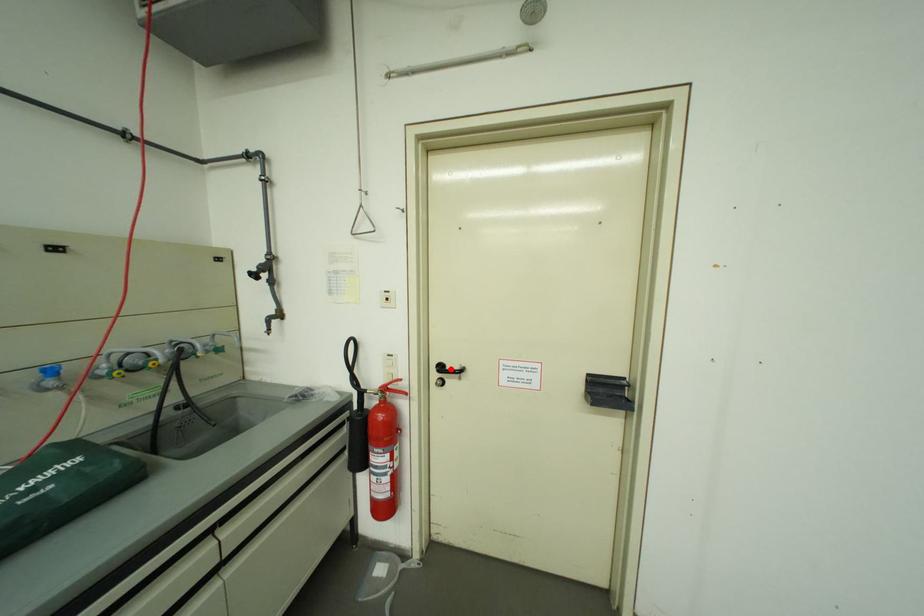
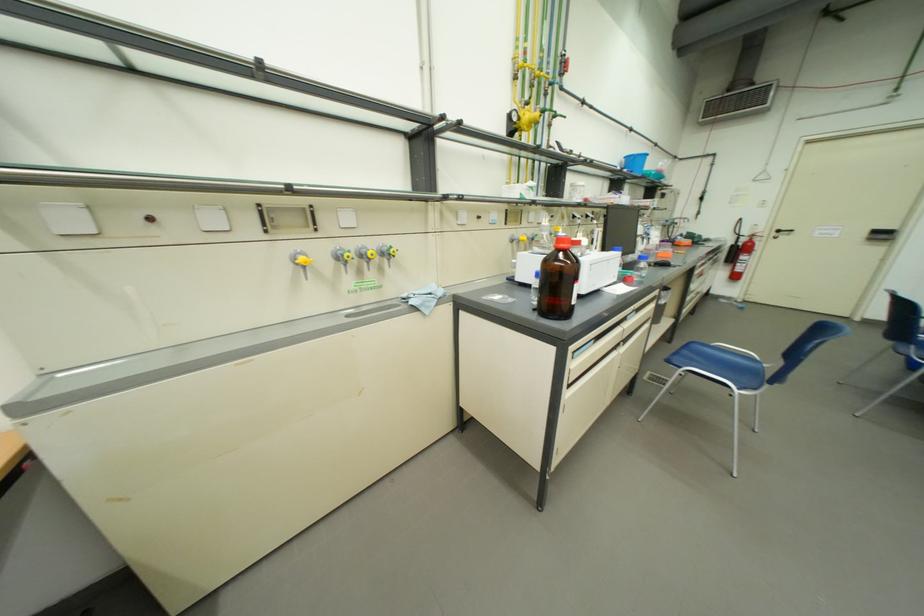
Locate, in the second image, the point that corresponds to the highlighted location in the first image.

(787, 233)